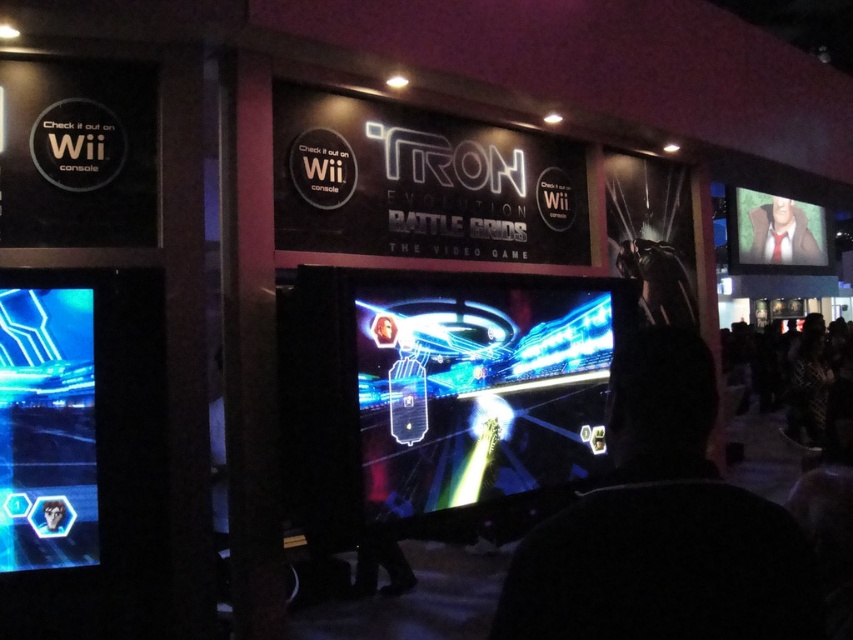
You are a game tester at the event and need to access the controls of the neon glossy game at center. However, there is a black fabric at center covering it. Based on the scene description, can you determine if the controls are accessible?

The black fabric at center is positioned over neon glossy game at center, so the controls of the neon glossy game at center are likely covered and inaccessible.

You are standing in the gaming area and want to know which of the two points, point (630, 588) or point (540, 390), is closer to you. Can you determine this based on the scene?

Point (630, 588) is closer to the viewer than point (540, 390).

You are setting up a booth for the TRON Evolution game. You have a black fabric at center and a glossy plastic screen at lower left. Which object should you place first if you want to prioritize larger items first?

The black fabric at center is bigger than the glossy plastic screen at lower left, so you should place the black fabric at center first.